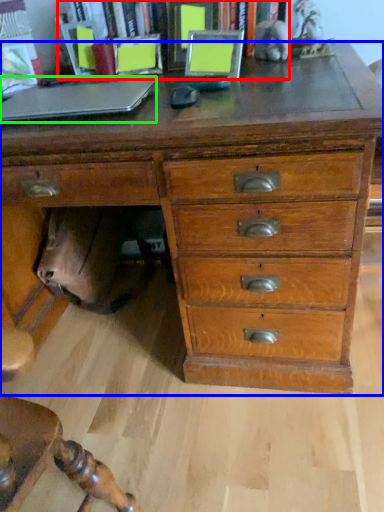
Question: Based on their relative distances, which object is nearer to bookcase (highlighted by a red box)? Choose from chest of drawers (highlighted by a blue box) and laptop (highlighted by a green box).

Choices:
 (A) chest of drawers
 (B) laptop

Answer: (B)